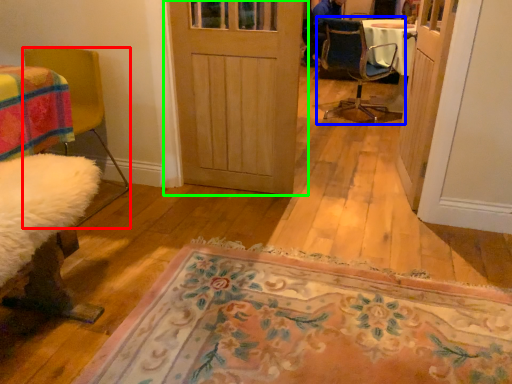
Question: Which object is positioned closest to chair (highlighted by a red box)? Select from chair (highlighted by a blue box) and door (highlighted by a green box).

Choices:
 (A) chair
 (B) door

Answer: (B)